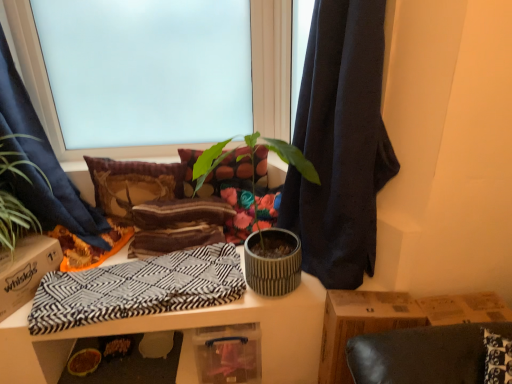
Question: Considering the relative sizes of textured concrete pot at center, positioned as the second houseplant in left-to-right order, and textured fabric pillow at center, which appears as the second pillow when viewed from the left, in the image provided, is textured concrete pot at center, positioned as the second houseplant in left-to-right order, shorter than textured fabric pillow at center, which appears as the second pillow when viewed from the left,?

Choices:
 (A) no
 (B) yes

Answer: (A)

Question: Does textured concrete pot at center, which is the 1th houseplant in right-to-left order, appear on the right side of textured fabric pillow at center, which appears as the second pillow when viewed from the left?

Choices:
 (A) yes
 (B) no

Answer: (A)

Question: From a real-world perspective, is textured concrete pot at center, which is the 1th houseplant in right-to-left order, on top of textured fabric pillow at center, marked as the first pillow in a right-to-left arrangement?

Choices:
 (A) no
 (B) yes

Answer: (B)

Question: From the image's perspective, is textured concrete pot at center, which is the 1th houseplant in right-to-left order, above textured fabric pillow at center, which appears as the second pillow when viewed from the left?

Choices:
 (A) yes
 (B) no

Answer: (B)

Question: Is textured concrete pot at center, positioned as the second houseplant in left-to-right order, to the left of textured fabric pillow at center, marked as the first pillow in a right-to-left arrangement, from the viewer's perspective?

Choices:
 (A) yes
 (B) no

Answer: (B)

Question: Does textured concrete pot at center, positioned as the second houseplant in left-to-right order, have a lesser width compared to textured fabric pillow at center, marked as the first pillow in a right-to-left arrangement?

Choices:
 (A) no
 (B) yes

Answer: (A)

Question: From a real-world perspective, is textured concrete pot at center, which is the 1th houseplant in right-to-left order, beneath blue fabric curtain at left, which is the 1th curtain from left to right?

Choices:
 (A) yes
 (B) no

Answer: (A)

Question: Is blue fabric curtain at left, the 2th curtain positioned from the right, inside textured concrete pot at center, which is the 1th houseplant in right-to-left order?

Choices:
 (A) yes
 (B) no

Answer: (B)

Question: Is textured concrete pot at center, positioned as the second houseplant in left-to-right order, with blue fabric curtain at left, the 2th curtain positioned from the right?

Choices:
 (A) no
 (B) yes

Answer: (A)

Question: Can you confirm if textured concrete pot at center, which is the 1th houseplant in right-to-left order, is wider than blue fabric curtain at left, the 2th curtain positioned from the right?

Choices:
 (A) no
 (B) yes

Answer: (A)

Question: Is textured concrete pot at center, which is the 1th houseplant in right-to-left order, smaller than blue fabric curtain at left, the 2th curtain positioned from the right?

Choices:
 (A) yes
 (B) no

Answer: (A)

Question: Considering the relative positions of textured concrete pot at center, positioned as the second houseplant in left-to-right order, and blue fabric curtain at left, which is the 1th curtain from left to right, in the image provided, is textured concrete pot at center, positioned as the second houseplant in left-to-right order, behind blue fabric curtain at left, which is the 1th curtain from left to right,?

Choices:
 (A) yes
 (B) no

Answer: (A)

Question: Is dark blue fabric at center, which ranks as the second curtain in left-to-right order, placed right next to textured concrete pot at center, positioned as the second houseplant in left-to-right order?

Choices:
 (A) no
 (B) yes

Answer: (A)